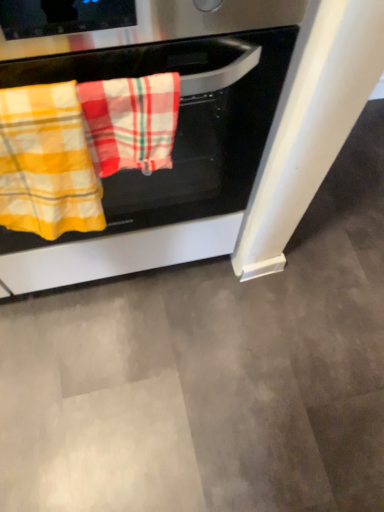
Question: Is plaid cotton beach towel at center, the second beach towel viewed from the left, thinner than yellow plaid towel at left, which ranks as the 2th beach towel in right-to-left order?

Choices:
 (A) yes
 (B) no

Answer: (B)

Question: From the image's perspective, is plaid cotton beach towel at center, acting as the 1th beach towel starting from the right, located above yellow plaid towel at left, which ranks as the 2th beach towel in right-to-left order?

Choices:
 (A) no
 (B) yes

Answer: (B)

Question: Is plaid cotton beach towel at center, acting as the 1th beach towel starting from the right, at the left side of yellow plaid towel at left, which ranks as the 2th beach towel in right-to-left order?

Choices:
 (A) no
 (B) yes

Answer: (A)

Question: Does plaid cotton beach towel at center, the second beach towel viewed from the left, appear on the right side of yellow plaid towel at left, which ranks as the 2th beach towel in right-to-left order?

Choices:
 (A) yes
 (B) no

Answer: (A)

Question: Would you say plaid cotton beach towel at center, acting as the 1th beach towel starting from the right, contains yellow plaid towel at left, positioned as the 1th beach towel in left-to-right order?

Choices:
 (A) yes
 (B) no

Answer: (B)

Question: In the image, is yellow plaid towel at left, positioned as the 1th beach towel in left-to-right order, positioned in front of or behind plaid cotton beach towel at center, acting as the 1th beach towel starting from the right?

Choices:
 (A) front
 (B) behind

Answer: (A)

Question: Would you say yellow plaid towel at left, which ranks as the 2th beach towel in right-to-left order, is inside or outside plaid cotton beach towel at center, acting as the 1th beach towel starting from the right?

Choices:
 (A) outside
 (B) inside

Answer: (A)

Question: From the image's perspective, is yellow plaid towel at left, which ranks as the 2th beach towel in right-to-left order, above or below plaid cotton beach towel at center, acting as the 1th beach towel starting from the right?

Choices:
 (A) below
 (B) above

Answer: (A)

Question: Is yellow plaid towel at left, positioned as the 1th beach towel in left-to-right order, bigger or smaller than plaid cotton beach towel at center, acting as the 1th beach towel starting from the right?

Choices:
 (A) big
 (B) small

Answer: (A)

Question: From their relative heights in the image, would you say plaid cotton beach towel at center, the second beach towel viewed from the left, is taller or shorter than stainless steel oven at center?

Choices:
 (A) short
 (B) tall

Answer: (A)

Question: In the image, is plaid cotton beach towel at center, acting as the 1th beach towel starting from the right, positioned in front of or behind stainless steel oven at center?

Choices:
 (A) front
 (B) behind

Answer: (B)

Question: Considering the positions of point (84, 117) and point (195, 58), is point (84, 117) closer or farther from the camera than point (195, 58)?

Choices:
 (A) closer
 (B) farther

Answer: (A)

Question: Would you say plaid cotton beach towel at center, the second beach towel viewed from the left, is to the left or to the right of stainless steel oven at center in the picture?

Choices:
 (A) left
 (B) right

Answer: (B)

Question: From the image's perspective, is plaid cotton beach towel at center, acting as the 1th beach towel starting from the right, above or below yellow plaid towel at left, which ranks as the 2th beach towel in right-to-left order?

Choices:
 (A) above
 (B) below

Answer: (A)

Question: Considering the positions of plaid cotton beach towel at center, acting as the 1th beach towel starting from the right, and yellow plaid towel at left, which ranks as the 2th beach towel in right-to-left order, in the image, is plaid cotton beach towel at center, acting as the 1th beach towel starting from the right, wider or thinner than yellow plaid towel at left, which ranks as the 2th beach towel in right-to-left order,?

Choices:
 (A) wide
 (B) thin

Answer: (B)